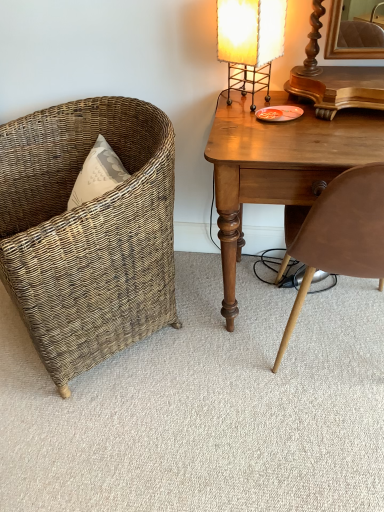
Identify the location of vacant area that is in front of matte yellow fabric lampshade at upper right. This screenshot has width=384, height=512. (266, 121).